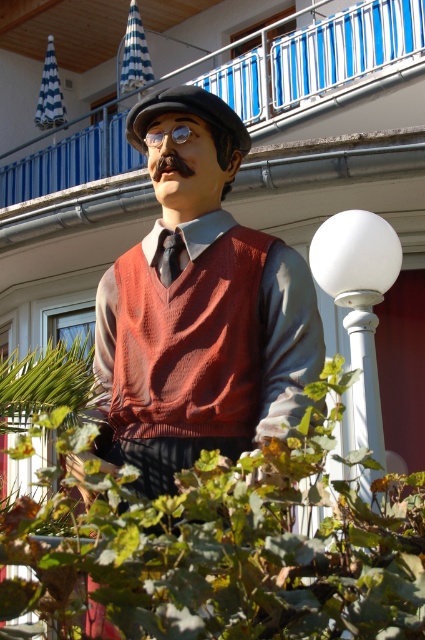
You are an artist trying to sketch the statue. You notice the matte brown vest at center and the black silk tie at center. Which object should you draw first if you want to capture the larger one first?

The matte brown vest at center is larger in size than the black silk tie at center, so you should draw the matte brown vest at center first.

You are an artist planning to sketch the statue. You notice the matte brown vest at center and the black silk tie at center. Which object should you draw first if you want to start with the wider one?

The matte brown vest at center should be drawn first because its width surpasses that of the black silk tie at center, making it the wider object.